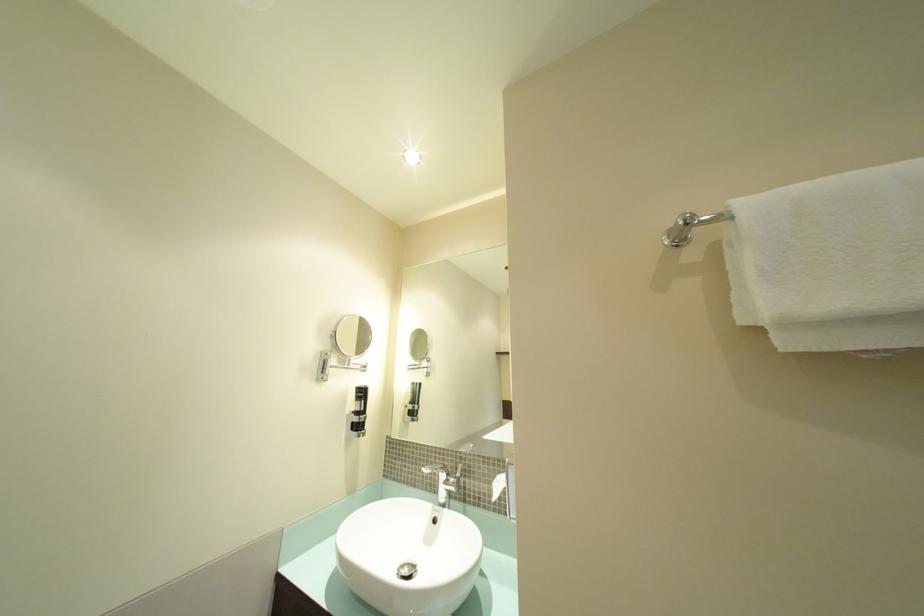
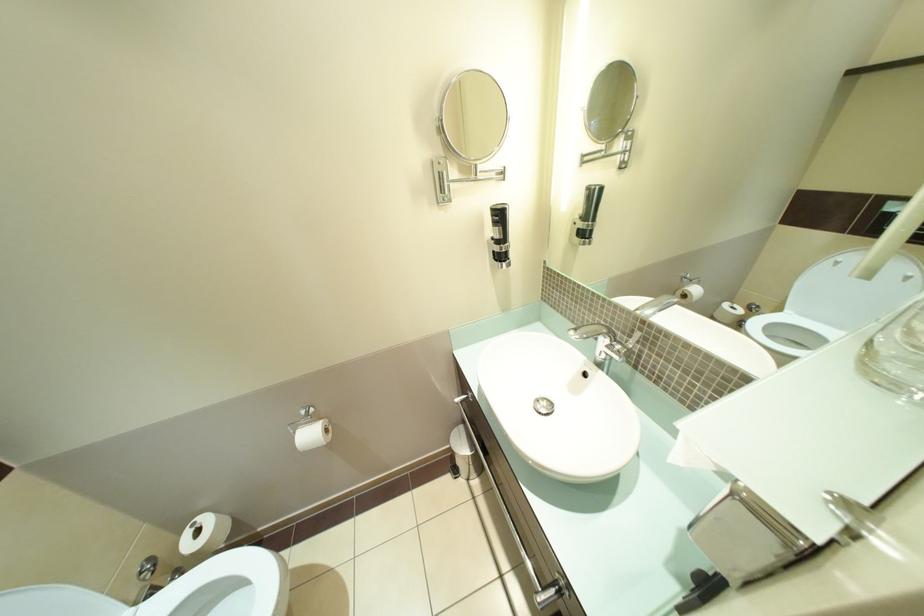
First-person continuous shooting, in which direction is the camera rotating?

The camera rotated toward left-down.